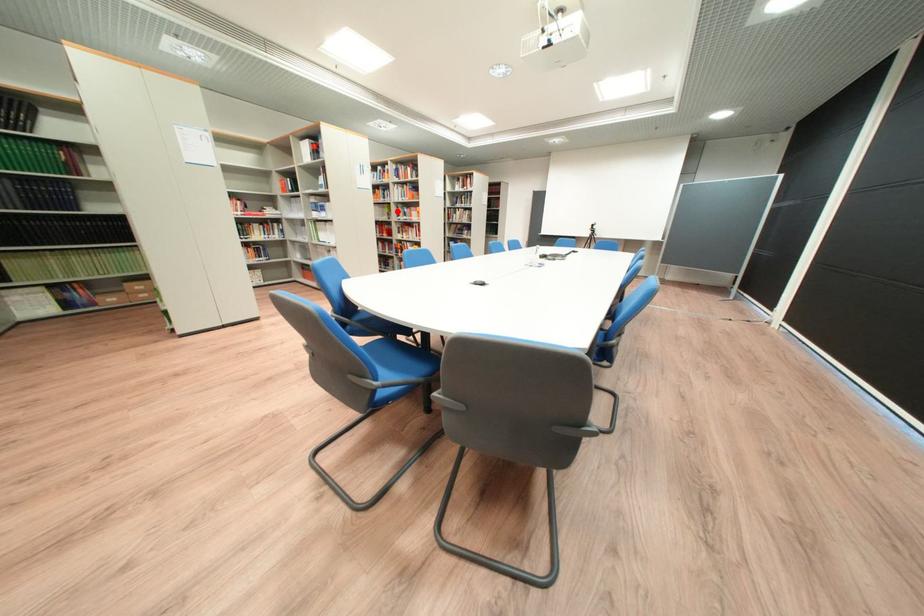
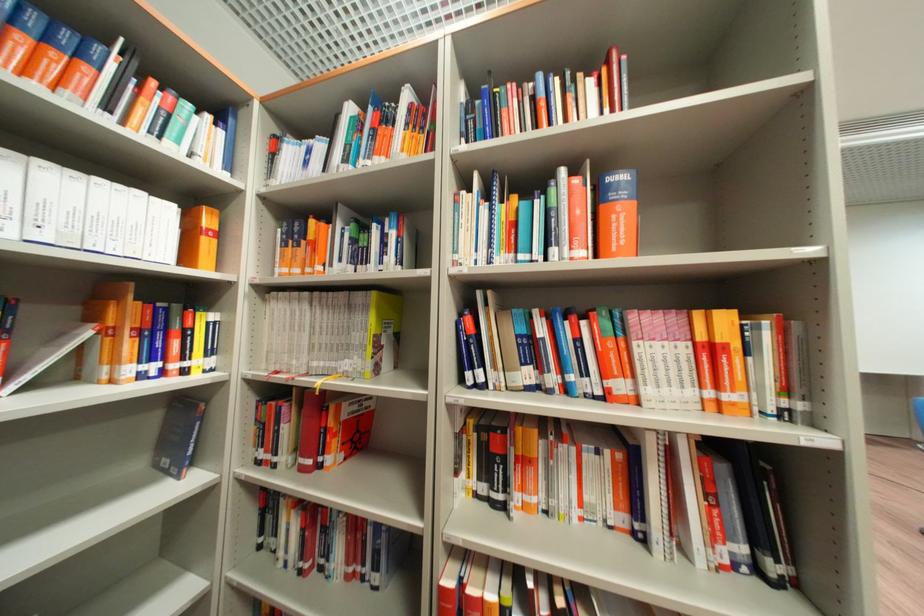
Question: I am providing you with two images of the same scene from different viewpoints. Image1 has a red point marked. In image2, the corresponding 3D location appears at what relative position? Reply with the corresponding letter.

Choices:
 (A) Closer
 (B) Farther

Answer: (B)